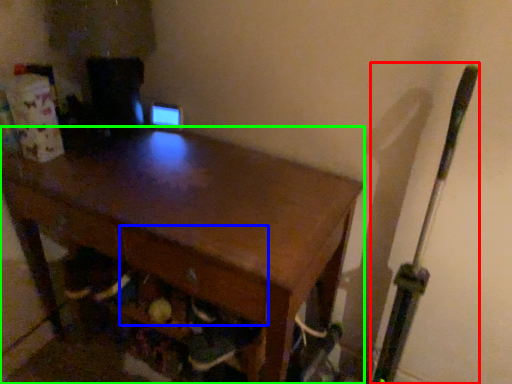
Question: Estimate the real-world distances between objects in this image. Which object is closer to baseball bat (highlighted by a red box), drawer (highlighted by a blue box) or desk (highlighted by a green box)?

Choices:
 (A) drawer
 (B) desk

Answer: (A)